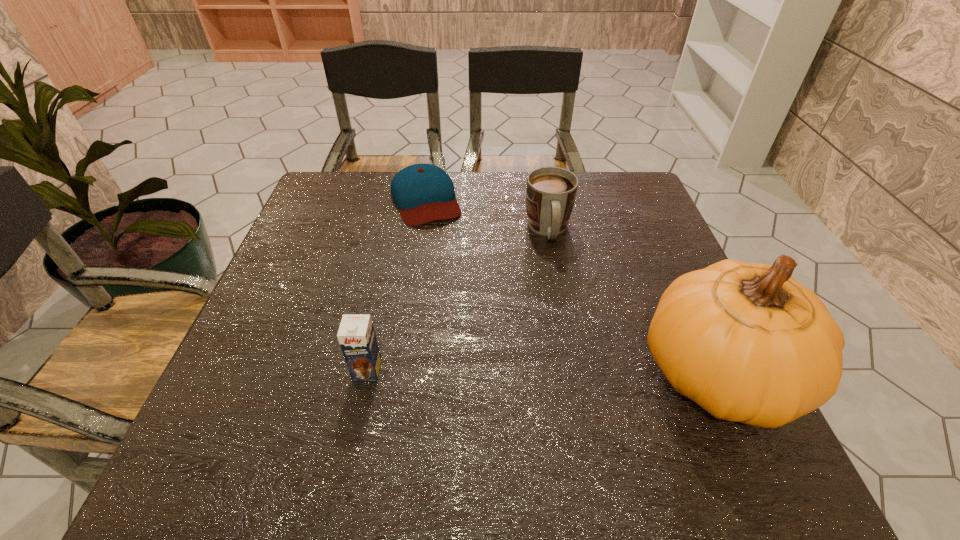
Locate an element on the screen. This screenshot has width=960, height=540. blank region between the mug and the shortest object is located at coordinates (487, 215).

At what (x,y) coordinates should I click in order to perform the action: click on the third closest object relative to the chocolate milk. Please return your answer as a coordinate pair (x, y). This screenshot has height=540, width=960. Looking at the image, I should click on (748, 343).

Identify which object is located as the nearest to the pumpkin. Please provide its 2D coordinates. Your answer should be formatted as a tuple, i.e. [(x, y)], where the tuple contains the x and y coordinates of a point satisfying the conditions above.

[(551, 191)]

Find the location of a particular element. The height and width of the screenshot is (540, 960). vacant space that satisfies the following two spatial constraints: 1. on the front side of the second object from right to left; 2. on the left side of the baseball cap is located at coordinates (420, 230).

Find the location of a particular element. The width and height of the screenshot is (960, 540). vacant space that satisfies the following two spatial constraints: 1. on the front side of the pumpkin; 2. on the front face of the third object from left to right is located at coordinates (574, 375).